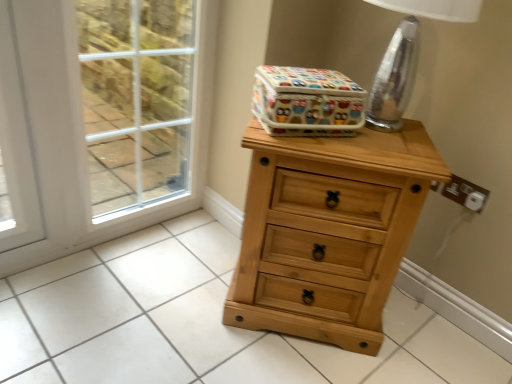
The image size is (512, 384). In order to click on spots to the right of natural wood chest of drawers at center in this screenshot , I will do `click(424, 337)`.